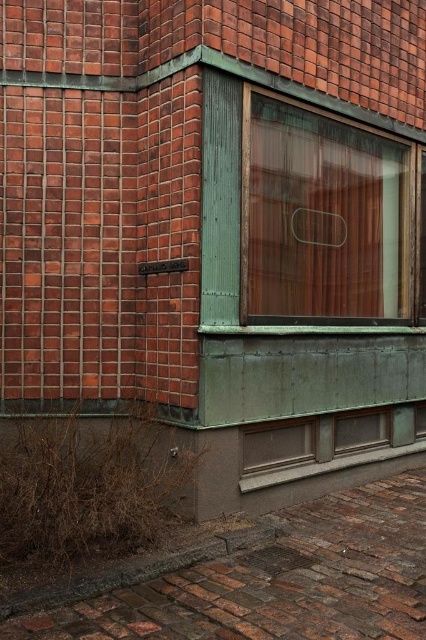
Question: Is translucent wood window at upper center positioned behind matte bronze window at lower center?

Choices:
 (A) yes
 (B) no

Answer: (B)

Question: Which object is closer to the camera taking this photo?

Choices:
 (A) translucent wood window at upper center
 (B) matte bronze window at lower center

Answer: (A)

Question: Which point appears farthest from the camera in this image?

Choices:
 (A) (351, 419)
 (B) (377, 209)

Answer: (B)

Question: Which point is closer to the camera?

Choices:
 (A) (357, 432)
 (B) (371, 145)

Answer: (A)

Question: Does translucent wood window at upper center have a lesser width compared to matte bronze window at lower center?

Choices:
 (A) no
 (B) yes

Answer: (A)

Question: Is translucent wood window at upper center below matte bronze window at lower center?

Choices:
 (A) yes
 (B) no

Answer: (B)